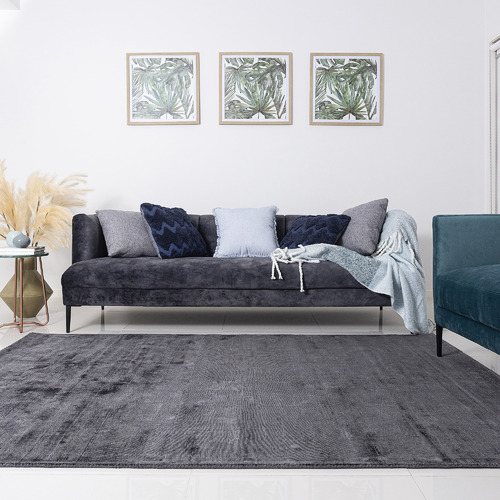
You are a GUI agent. You are given a task and a screenshot of the screen. Output one action in this format:
    pyautogui.click(x=<x>, y=<y>)
    Task: Click on the blanket
    
    Given the screenshot: What is the action you would take?
    point(407,263)